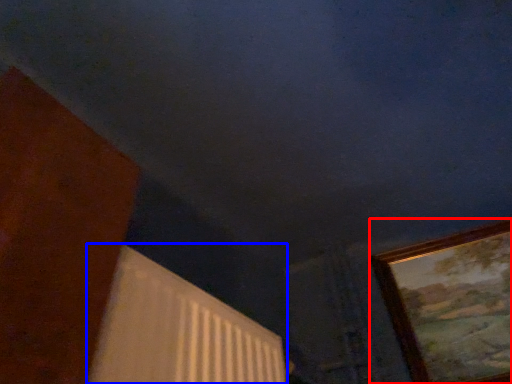
Question: Which object appears closest to the camera in this image, picture frame (highlighted by a red box) or radiator (highlighted by a blue box)?

Choices:
 (A) picture frame
 (B) radiator

Answer: (B)